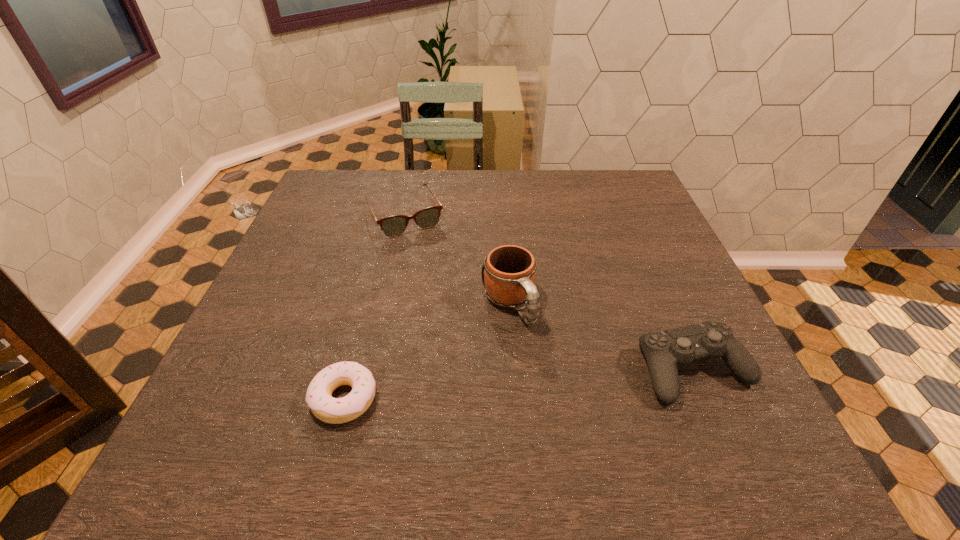
Where is `free spot on the desktop that is between the doughnut and the control and is positioned at the front view of the second shortest object`? free spot on the desktop that is between the doughnut and the control and is positioned at the front view of the second shortest object is located at coordinates (497, 386).

Identify the location of free space on the desktop that is between the doughnut and the rightmost object and is positioned on the side of the tallest object with the handle. The width and height of the screenshot is (960, 540). (559, 381).